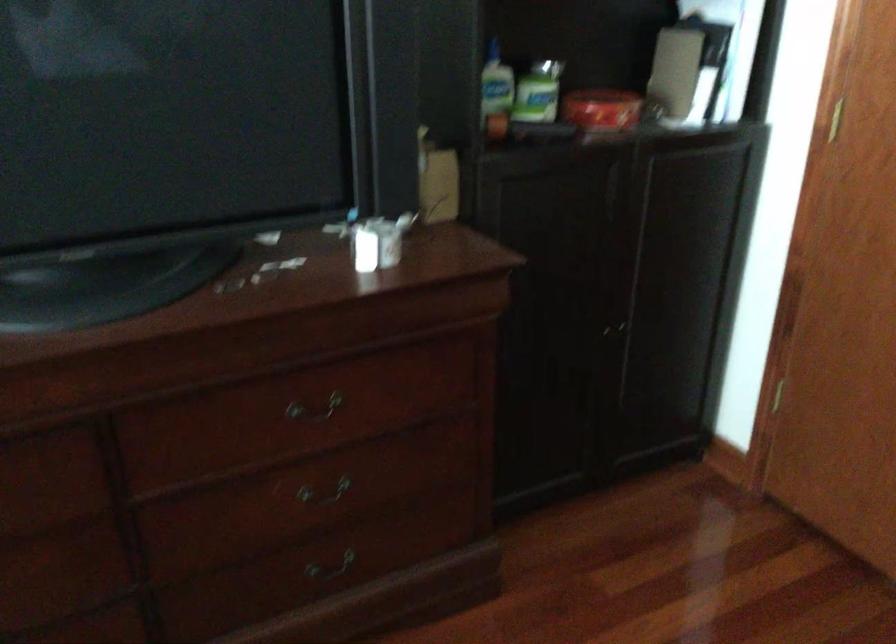
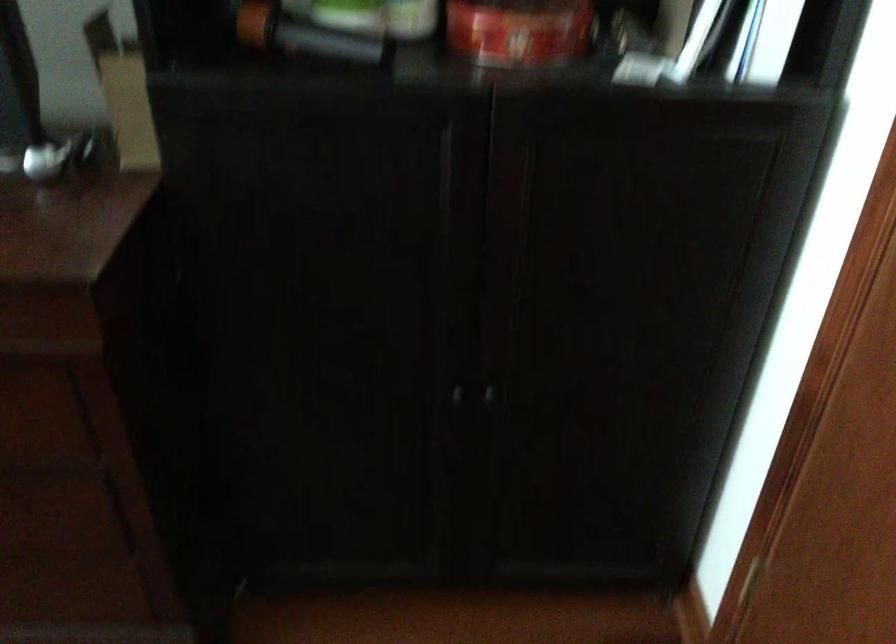
In a continuous first-person perspective shot, in which direction is the camera moving?

The cameraman walked toward right, forward.